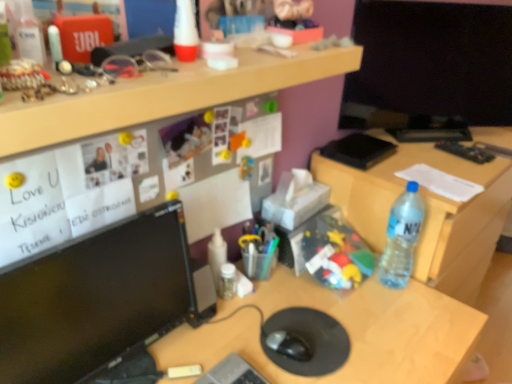
At what (x,y) coordinates should I click in order to perform the action: click on free space that is in between translucent plastic bottle at right, which appears as the 1th bottle when viewed from the right, and black rubber mousepad at center. Please return your answer as a coordinate pair (x, y). Image resolution: width=512 pixels, height=384 pixels. Looking at the image, I should click on (356, 300).